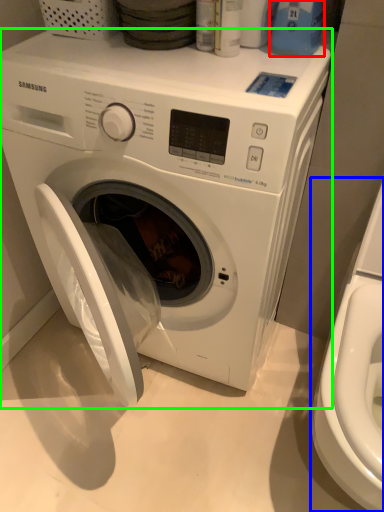
Question: Which is nearer to the cleaning product (highlighted by a red box)? washer (highlighted by a blue box) or washing machine (highlighted by a green box).

Choices:
 (A) washer
 (B) washing machine

Answer: (B)